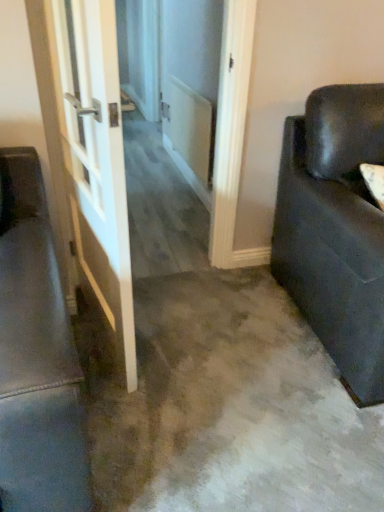
Question: Does matte black couch at right touch white glossy door at left?

Choices:
 (A) no
 (B) yes

Answer: (A)

Question: Can you confirm if matte black couch at right is positioned to the left of white glossy door at left?

Choices:
 (A) yes
 (B) no

Answer: (B)

Question: Is matte black couch at right wider than white glossy door at left?

Choices:
 (A) no
 (B) yes

Answer: (B)

Question: Considering the relative sizes of matte black couch at right and white glossy door at left in the image provided, is matte black couch at right smaller than white glossy door at left?

Choices:
 (A) no
 (B) yes

Answer: (A)

Question: Would you say matte black couch at right contains white glossy door at left?

Choices:
 (A) yes
 (B) no

Answer: (B)

Question: Is matte black couch at right facing towards white glossy door at left?

Choices:
 (A) no
 (B) yes

Answer: (A)

Question: Would you say white glossy door at left is a long distance from matte black couch at right?

Choices:
 (A) yes
 (B) no

Answer: (B)

Question: Is the depth of white glossy door at left greater than that of matte black couch at right?

Choices:
 (A) no
 (B) yes

Answer: (A)

Question: Is white glossy door at left taller than matte black couch at right?

Choices:
 (A) no
 (B) yes

Answer: (B)

Question: Does white glossy door at left appear on the right side of matte black couch at right?

Choices:
 (A) no
 (B) yes

Answer: (A)

Question: Is white glossy door at left next to matte black couch at right and touching it?

Choices:
 (A) no
 (B) yes

Answer: (A)

Question: From the image's perspective, does white glossy door at left appear lower than matte black couch at right?

Choices:
 (A) yes
 (B) no

Answer: (B)

Question: Considering the positions of white glossy door at left and matte black couch at right in the image, is white glossy door at left taller or shorter than matte black couch at right?

Choices:
 (A) tall
 (B) short

Answer: (A)